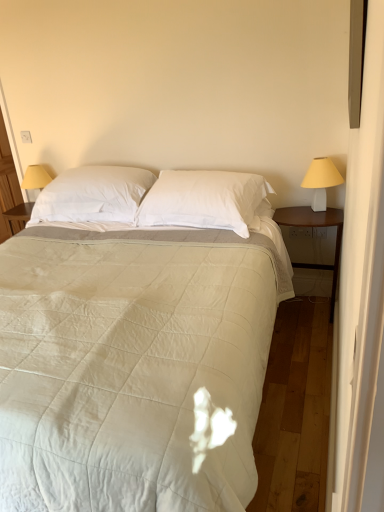
Find the location of a particular element. The image size is (384, 512). empty space that is ontop of wooden nightstand at right (from a real-world perspective) is located at coordinates pyautogui.click(x=308, y=212).